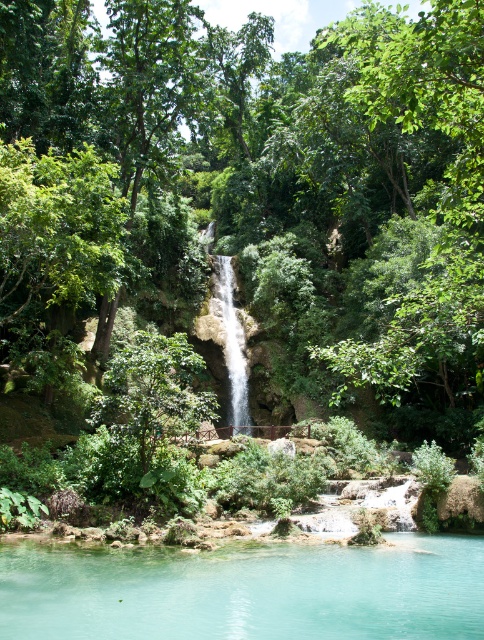
Which of these two, turquoise clear water at center or translucent glass waterfall at center, stands shorter?

With less height is turquoise clear water at center.

Can you confirm if turquoise clear water at center is bigger than translucent glass waterfall at center?

Incorrect, turquoise clear water at center is not larger than translucent glass waterfall at center.

Who is more distant from viewer, (45,632) or (241,368)?

The point (241,368) is behind.

The height and width of the screenshot is (640, 484). Find the location of `turquoise clear water at center`. turquoise clear water at center is located at coordinates (245, 592).